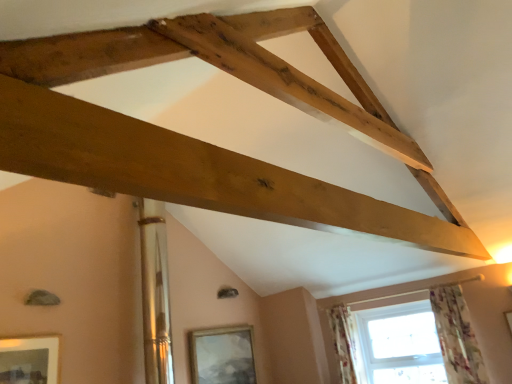
Question: In terms of width, does matte gold picture frame at lower left, the second picture frame in the right-to-left sequence, look wider or thinner when compared to clear glass window at lower right?

Choices:
 (A) wide
 (B) thin

Answer: (B)

Question: Based on their sizes in the image, would you say matte gold picture frame at lower left, the second picture frame from the bottom, is bigger or smaller than clear glass window at lower right?

Choices:
 (A) big
 (B) small

Answer: (B)

Question: Estimate the real-world distances between objects in this image. Which object is closer to the natural wood beam at upper center?

Choices:
 (A) floral fabric curtain at lower right, placed as the 2th curtain when sorted from back to front
 (B) floral fabric curtain at lower right, positioned as the second curtain in right-to-left order
 (C) matte silver picture frame at lower center, positioned as the 1th picture frame in back-to-front order
 (D) clear glass window at lower right
 (E) matte gold picture frame at lower left, which appears as the 2th picture frame when viewed from the back

Answer: (A)

Question: Estimate the real-world distances between objects in this image. Which object is farther from the floral fabric curtain at lower right, placed as the 2th curtain when sorted from back to front?

Choices:
 (A) floral fabric curtain at lower right, marked as the first curtain in a back-to-front arrangement
 (B) natural wood beam at upper center
 (C) matte gold picture frame at lower left, positioned as the 1th picture frame in left-to-right order
 (D) clear glass window at lower right
 (E) matte silver picture frame at lower center, positioned as the 1th picture frame in back-to-front order

Answer: (C)